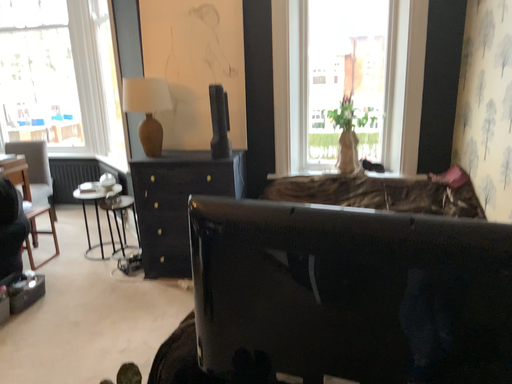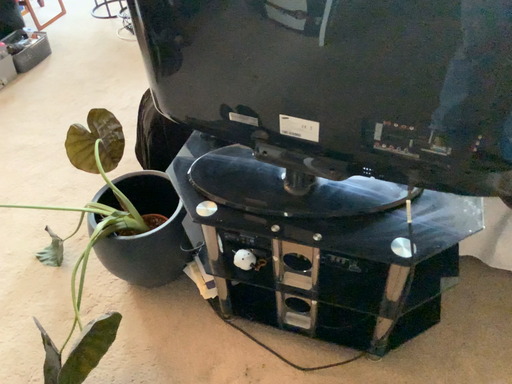
Question: Which way did the camera rotate in the video?

Choices:
 (A) rotated downward
 (B) rotated upward

Answer: (A)